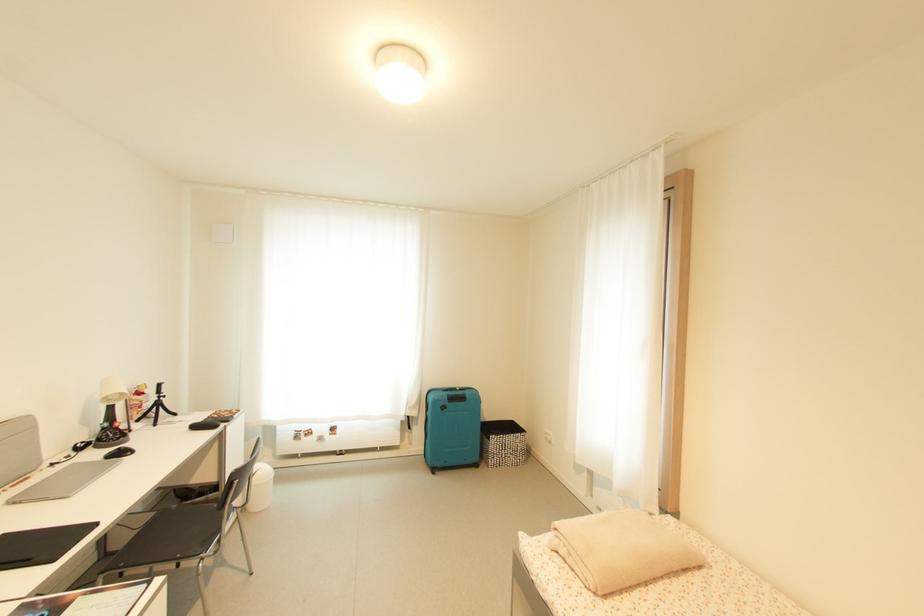
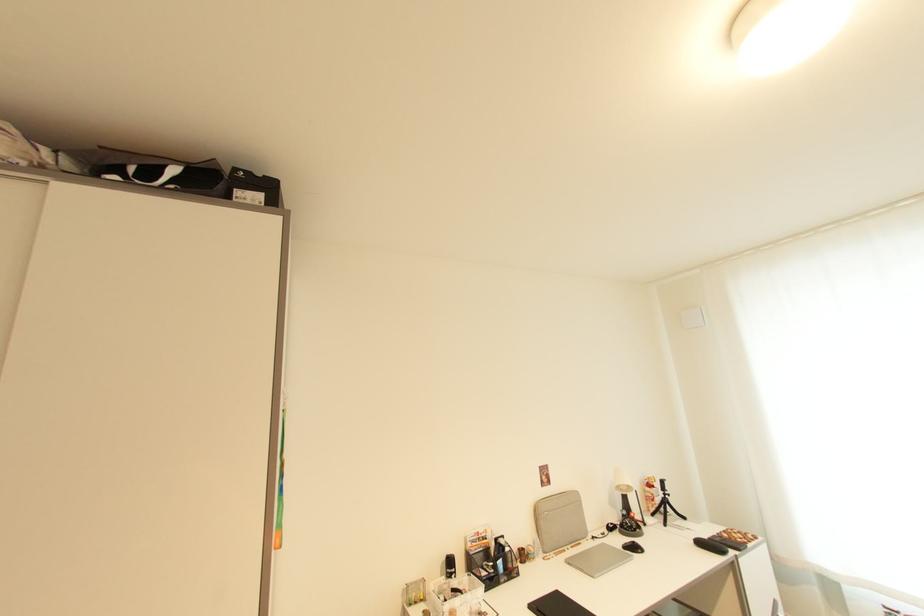
Locate, in the second image, the point that corresponds to pixel 162 400 in the first image.

(669, 498)